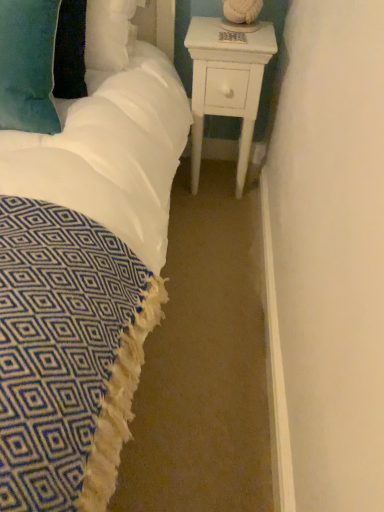
Question: From the image's perspective, is white wood nightstand at right located above or below velvety teal pillow at upper left?

Choices:
 (A) above
 (B) below

Answer: (B)

Question: Is white wood nightstand at right taller or shorter than velvety teal pillow at upper left?

Choices:
 (A) tall
 (B) short

Answer: (A)

Question: Is white wood nightstand at right spatially inside velvety teal pillow at upper left, or outside of it?

Choices:
 (A) inside
 (B) outside

Answer: (B)

Question: From a real-world perspective, is velvety teal pillow at upper left physically located above or below white wood nightstand at right?

Choices:
 (A) above
 (B) below

Answer: (A)

Question: In terms of height, does velvety teal pillow at upper left look taller or shorter compared to white wood nightstand at right?

Choices:
 (A) short
 (B) tall

Answer: (A)

Question: Based on their positions, is velvety teal pillow at upper left located to the left or right of white wood nightstand at right?

Choices:
 (A) left
 (B) right

Answer: (A)

Question: Is velvety teal pillow at upper left spatially inside white wood nightstand at right, or outside of it?

Choices:
 (A) outside
 (B) inside

Answer: (A)